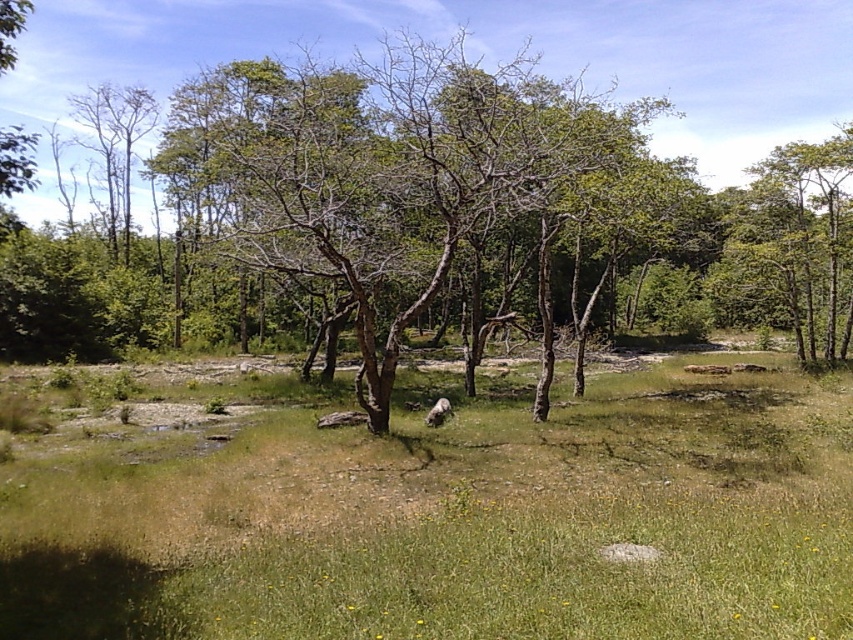
Is green grass at center thinner than green leafy tree at upper right?

Yes, green grass at center is thinner than green leafy tree at upper right.

Which is more to the left, green grass at center or green leafy tree at upper right?

From the viewer's perspective, green grass at center appears more on the left side.

Identify the location of green grass at center. Image resolution: width=853 pixels, height=640 pixels. (444, 513).

Image resolution: width=853 pixels, height=640 pixels. In order to click on green grass at center in this screenshot , I will do `click(444, 513)`.

Which is below, green grass at center or brown wood tree at center?

green grass at center is below.

From the picture: Is green grass at center positioned in front of brown wood tree at center?

Yes, it is.

Describe the element at coordinates (444, 513) in the screenshot. The height and width of the screenshot is (640, 853). I see `green grass at center` at that location.

Locate an element on the screen. The width and height of the screenshot is (853, 640). green grass at center is located at coordinates (x=444, y=513).

Is brown wood tree at center closer to the viewer compared to green leafy tree at upper right?

No.

Is brown wood tree at center smaller than green leafy tree at upper right?

Actually, brown wood tree at center might be larger than green leafy tree at upper right.

Identify the location of brown wood tree at center. The image size is (853, 640). (485, 54).